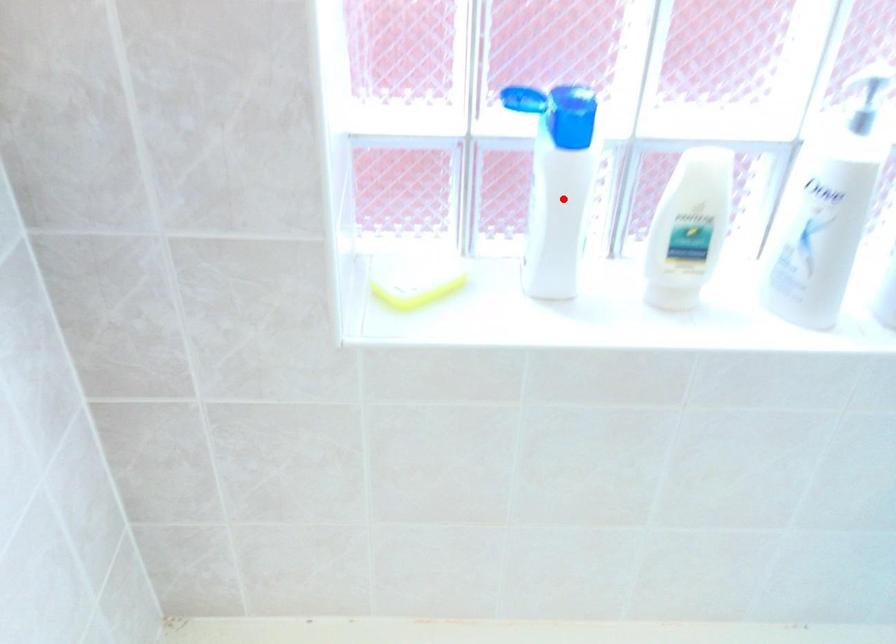
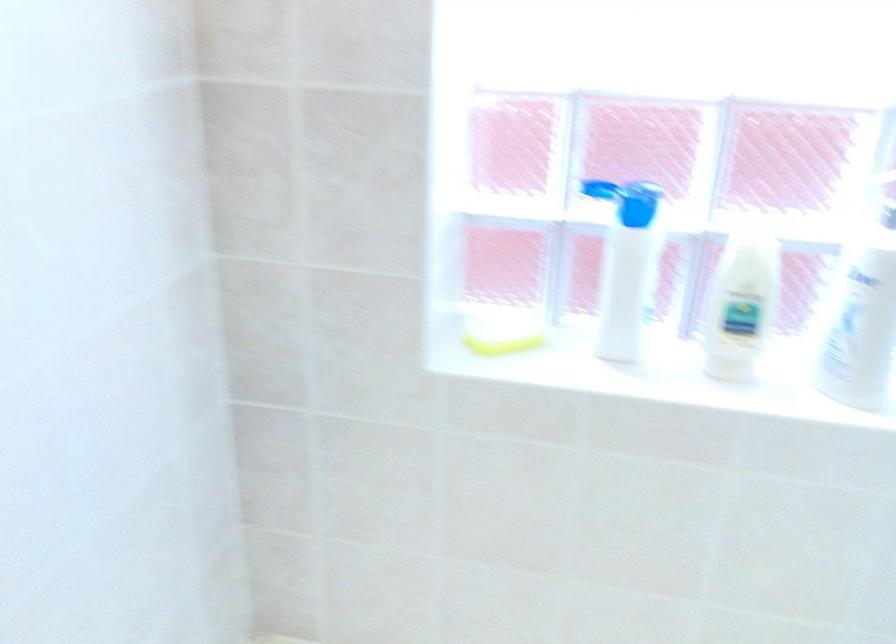
Find the pixel in the second image that matches the highlighted location in the first image.

(625, 266)